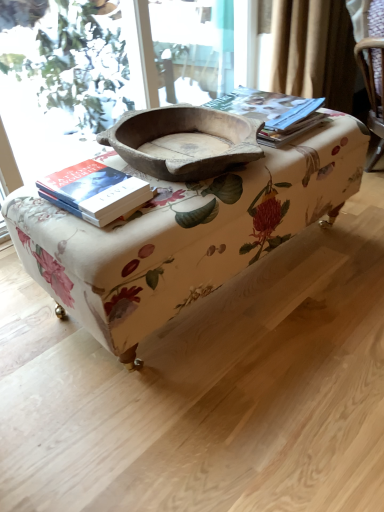
Question: Can you confirm if hardcover book at left is thinner than natural wood bowl at center?

Choices:
 (A) yes
 (B) no

Answer: (A)

Question: Does hardcover book at left have a larger size compared to natural wood bowl at center?

Choices:
 (A) yes
 (B) no

Answer: (B)

Question: Is hardcover book at left positioned in front of natural wood bowl at center?

Choices:
 (A) yes
 (B) no

Answer: (A)

Question: From the image's perspective, is hardcover book at left located beneath natural wood bowl at center?

Choices:
 (A) yes
 (B) no

Answer: (A)

Question: From the image's perspective, is hardcover book at left over natural wood bowl at center?

Choices:
 (A) no
 (B) yes

Answer: (A)

Question: From a real-world perspective, is hardcover book at left above or below matte paper at upper right?

Choices:
 (A) above
 (B) below

Answer: (B)

Question: Is hardcover book at left bigger or smaller than matte paper at upper right?

Choices:
 (A) small
 (B) big

Answer: (A)

Question: Visually, is hardcover book at left positioned to the left or to the right of matte paper at upper right?

Choices:
 (A) right
 (B) left

Answer: (B)

Question: From the image's perspective, relative to matte paper at upper right, is hardcover book at left above or below?

Choices:
 (A) below
 (B) above

Answer: (A)

Question: Considering the positions of floral fabric ottoman at center and natural wood bowl at center in the image, is floral fabric ottoman at center wider or thinner than natural wood bowl at center?

Choices:
 (A) thin
 (B) wide

Answer: (A)

Question: From the image's perspective, is floral fabric ottoman at center located above or below natural wood bowl at center?

Choices:
 (A) above
 (B) below

Answer: (B)

Question: Is floral fabric ottoman at center taller or shorter than natural wood bowl at center?

Choices:
 (A) short
 (B) tall

Answer: (B)

Question: From a real-world perspective, is floral fabric ottoman at center above or below natural wood bowl at center?

Choices:
 (A) below
 (B) above

Answer: (A)

Question: Looking at their shapes, would you say hardcover book at left is wider or thinner than natural wood bowl at center?

Choices:
 (A) thin
 (B) wide

Answer: (A)

Question: From the image's perspective, relative to natural wood bowl at center, is hardcover book at left above or below?

Choices:
 (A) below
 (B) above

Answer: (A)